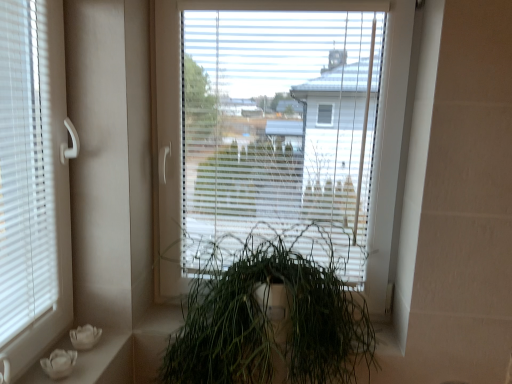
Question: Is transparent plastic window at center in front of white matte flower pots at lower left?

Choices:
 (A) yes
 (B) no

Answer: (B)

Question: Does transparent plastic window at center have a lesser width compared to white matte flower pots at lower left?

Choices:
 (A) yes
 (B) no

Answer: (A)

Question: Is transparent plastic window at center completely or partially outside of white matte flower pots at lower left?

Choices:
 (A) yes
 (B) no

Answer: (A)

Question: Does transparent plastic window at center have a greater height compared to white matte flower pots at lower left?

Choices:
 (A) yes
 (B) no

Answer: (A)

Question: Considering the relative sizes of transparent plastic window at center and white matte flower pots at lower left in the image provided, is transparent plastic window at center smaller than white matte flower pots at lower left?

Choices:
 (A) yes
 (B) no

Answer: (B)

Question: From the image's perspective, would you say transparent plastic window at center is shown under white matte flower pots at lower left?

Choices:
 (A) yes
 (B) no

Answer: (B)

Question: Is transparent plastic window at center not close to green matte plant at center?

Choices:
 (A) no
 (B) yes

Answer: (A)

Question: Considering the relative sizes of transparent plastic window at center and green matte plant at center in the image provided, is transparent plastic window at center smaller than green matte plant at center?

Choices:
 (A) yes
 (B) no

Answer: (A)

Question: Considering the relative positions of transparent plastic window at center and green matte plant at center in the image provided, is transparent plastic window at center to the right of green matte plant at center from the viewer's perspective?

Choices:
 (A) yes
 (B) no

Answer: (A)

Question: Is transparent plastic window at center behind green matte plant at center?

Choices:
 (A) no
 (B) yes

Answer: (B)

Question: Is transparent plastic window at center looking in the opposite direction of green matte plant at center?

Choices:
 (A) yes
 (B) no

Answer: (B)

Question: Is transparent plastic window at center outside green matte plant at center?

Choices:
 (A) yes
 (B) no

Answer: (A)

Question: Does green matte plant at center have a lesser width compared to white matte flower pots at lower left?

Choices:
 (A) no
 (B) yes

Answer: (A)